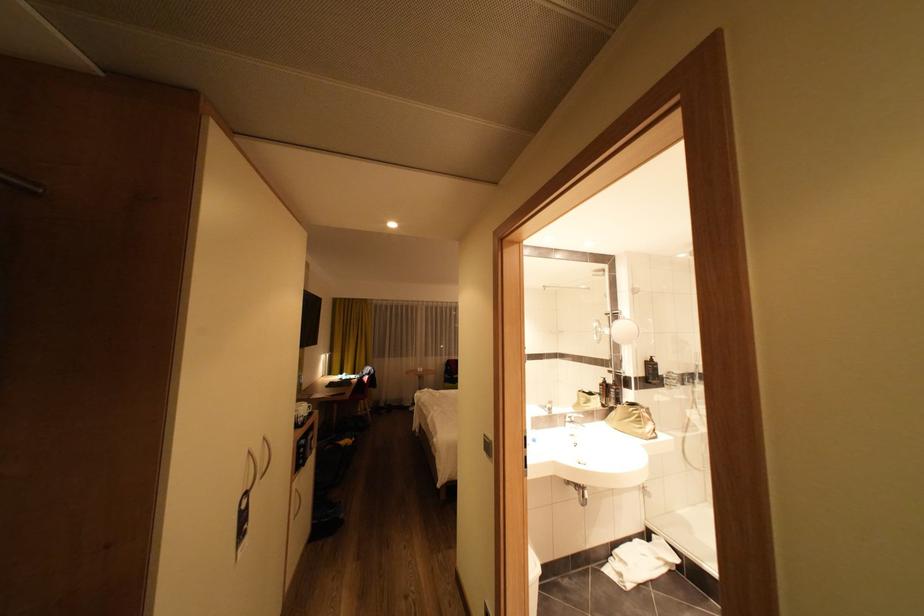
What are the coordinates of `faucet lever` in the screenshot? It's located at (574, 422).